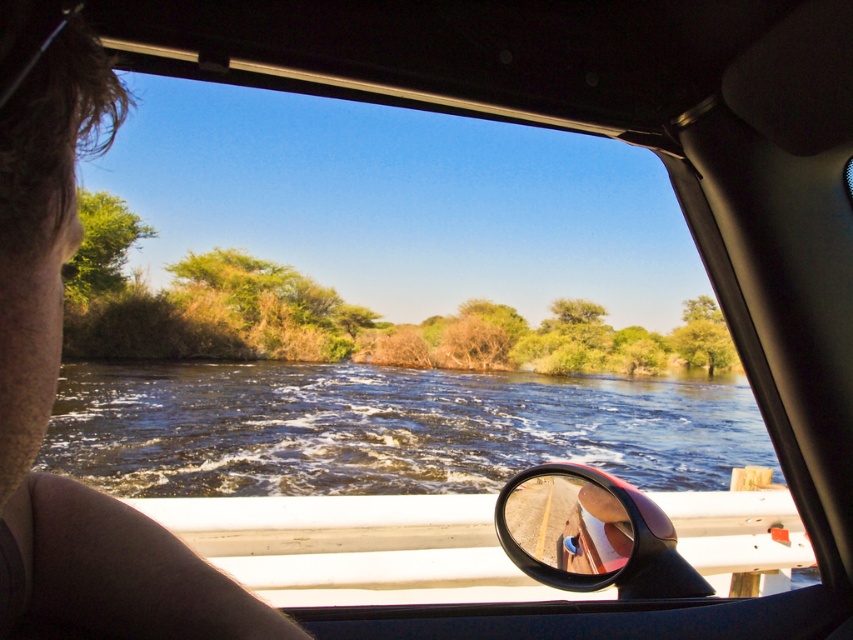
Question: Which is nearer to the brown hair at upper left?

Choices:
 (A) glossy plastic side mirror at lower center
 (B) brown water at center

Answer: (A)

Question: Among these points, which one is farthest from the camera?

Choices:
 (A) (708, 433)
 (B) (575, 536)

Answer: (A)

Question: From the image, what is the correct spatial relationship of brown water at center in relation to brown hair at upper left?

Choices:
 (A) right
 (B) left

Answer: (B)

Question: Considering the real-world distances, which object is closest to the brown water at center?

Choices:
 (A) glossy plastic side mirror at lower center
 (B) brown hair at upper left

Answer: (A)

Question: Can you confirm if brown water at center is bigger than brown hair at upper left?

Choices:
 (A) yes
 (B) no

Answer: (A)

Question: Is brown hair at upper left below glossy plastic side mirror at lower center?

Choices:
 (A) yes
 (B) no

Answer: (B)